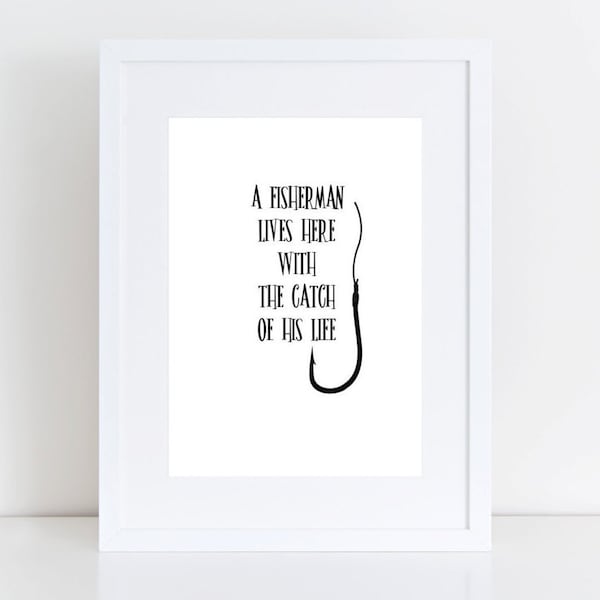
This screenshot has height=600, width=600. I want to click on top of mounting board, so click(290, 155).